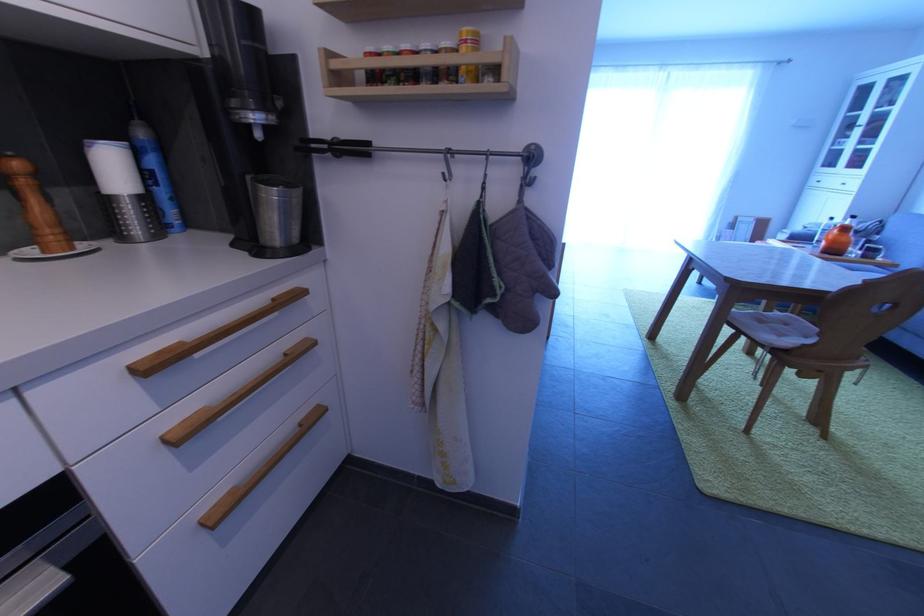
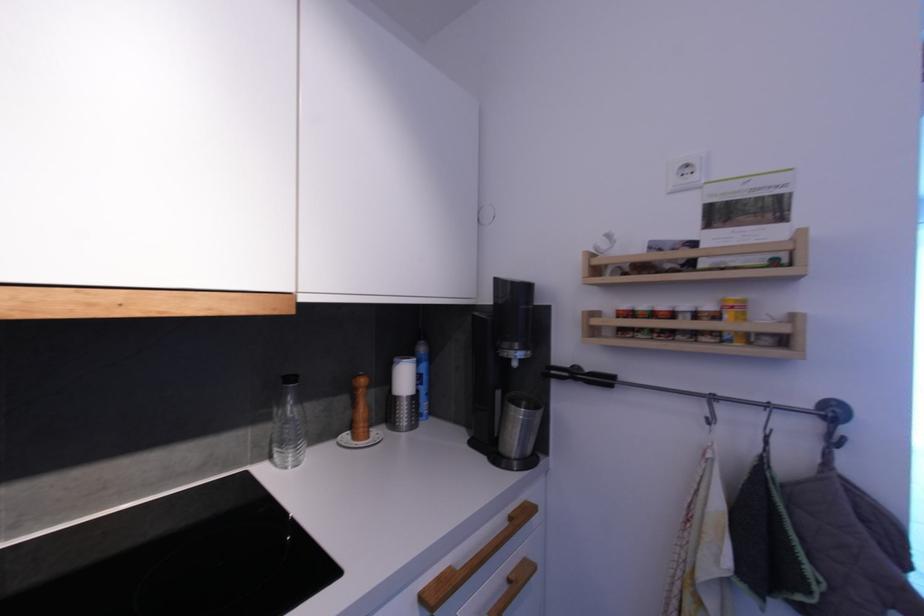
In the second image, find the point that corresponds to pixel 492 152 in the first image.

(773, 405)